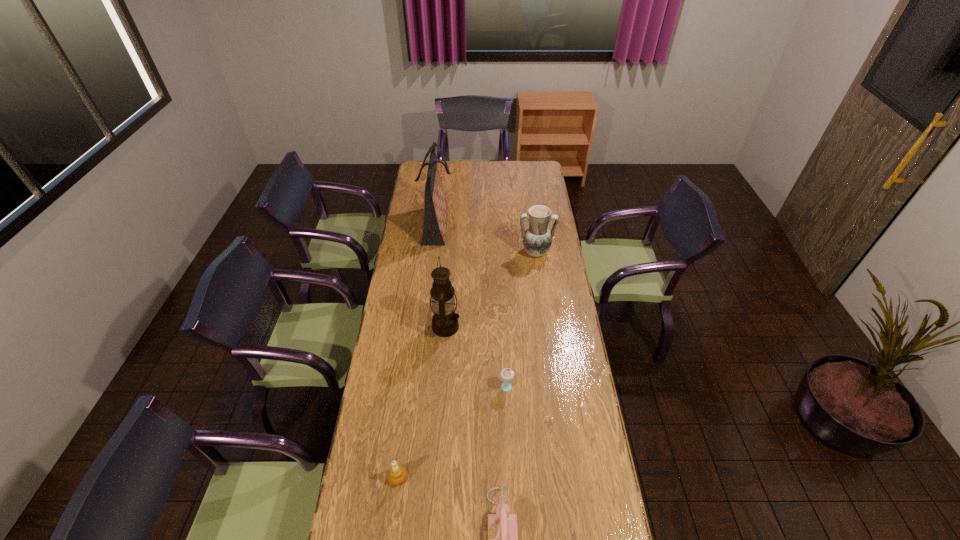
At what (x,y) coordinates should I click in order to perform the action: click on shopping bag. Please return your answer as a coordinate pair (x, y). Image resolution: width=960 pixels, height=540 pixels. Looking at the image, I should click on (436, 208).

I want to click on the third farthest object, so click(x=444, y=321).

The height and width of the screenshot is (540, 960). In order to click on the second tallest object in this screenshot , I will do `click(444, 321)`.

I want to click on pottery, so click(x=537, y=239).

Find the location of a particular element. The height and width of the screenshot is (540, 960). the rightmost object is located at coordinates (537, 239).

You are a GUI agent. You are given a task and a screenshot of the screen. Output one action in this format:
    pyautogui.click(x=<x>, y=<y>)
    Task: Click on the third nearest object
    The width and height of the screenshot is (960, 540).
    Given the screenshot: What is the action you would take?
    pyautogui.click(x=507, y=374)

Image resolution: width=960 pixels, height=540 pixels. In order to click on candle_holder in this screenshot , I will do `click(397, 475)`.

In order to click on vacant space located 0.230m on the front-facing side of the shopping bag in this screenshot , I will do `click(495, 226)`.

Find the location of a particular element. free location located on the back of the fourth nearest object is located at coordinates (448, 291).

You are a GUI agent. You are given a task and a screenshot of the screen. Output one action in this format:
    pyautogui.click(x=<x>, y=<y>)
    Task: Click on the vacant space located 0.360m on either side of the rightmost object
    The width and height of the screenshot is (960, 540).
    Given the screenshot: What is the action you would take?
    pyautogui.click(x=544, y=318)